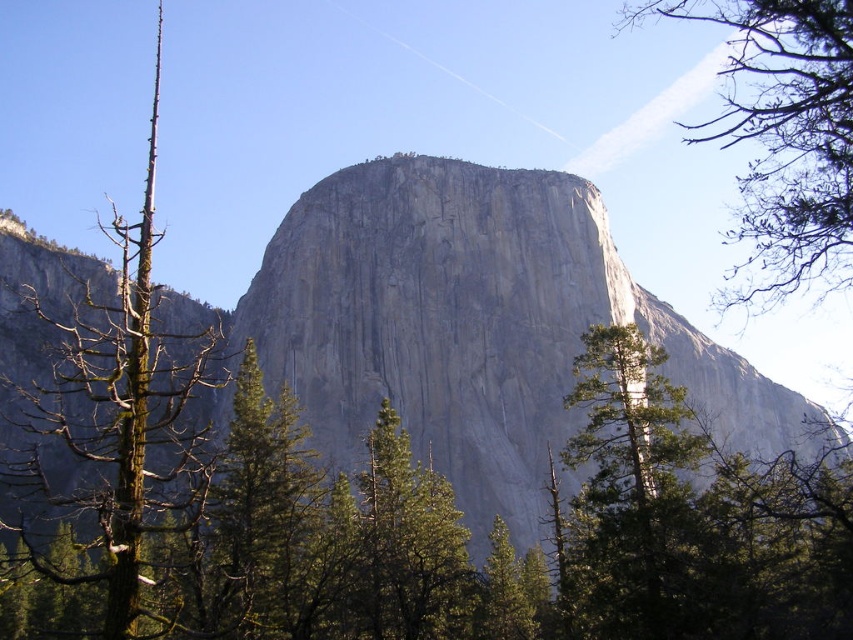
Question: Is gray/rough rock at center to the left of green textured tree at center from the viewer's perspective?

Choices:
 (A) yes
 (B) no

Answer: (A)

Question: Which object is farther from the camera taking this photo?

Choices:
 (A) gray/rough rock at center
 (B) green textured tree at center

Answer: (A)

Question: Which object is positioned closest to the green leafy tree at upper right?

Choices:
 (A) green textured tree at center
 (B) brown/dried wood at left
 (C) gray/rough rock at center

Answer: (A)

Question: Does green leafy tree at upper right appear on the left side of brown/dried wood at left?

Choices:
 (A) no
 (B) yes

Answer: (A)

Question: Among these objects, which one is farthest from the camera?

Choices:
 (A) green leafy tree at upper right
 (B) brown/dried wood at left

Answer: (A)

Question: Can you confirm if green leafy tree at upper right is smaller than green textured tree at center?

Choices:
 (A) no
 (B) yes

Answer: (A)